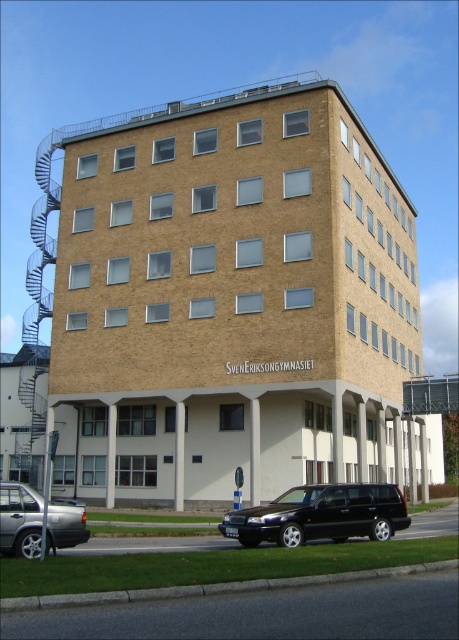
Question: Is black metallic car at lower center below silver metallic sedan at lower left?

Choices:
 (A) yes
 (B) no

Answer: (A)

Question: Which point appears closest to the camera in this image?

Choices:
 (A) (223, 525)
 (B) (22, 502)

Answer: (B)

Question: Among these points, which one is farthest from the camera?

Choices:
 (A) (67, 506)
 (B) (335, 488)

Answer: (B)

Question: Does black metallic car at lower center have a larger size compared to silver metallic sedan at lower left?

Choices:
 (A) yes
 (B) no

Answer: (A)

Question: Is black metallic car at lower center bigger than silver metallic sedan at lower left?

Choices:
 (A) no
 (B) yes

Answer: (B)